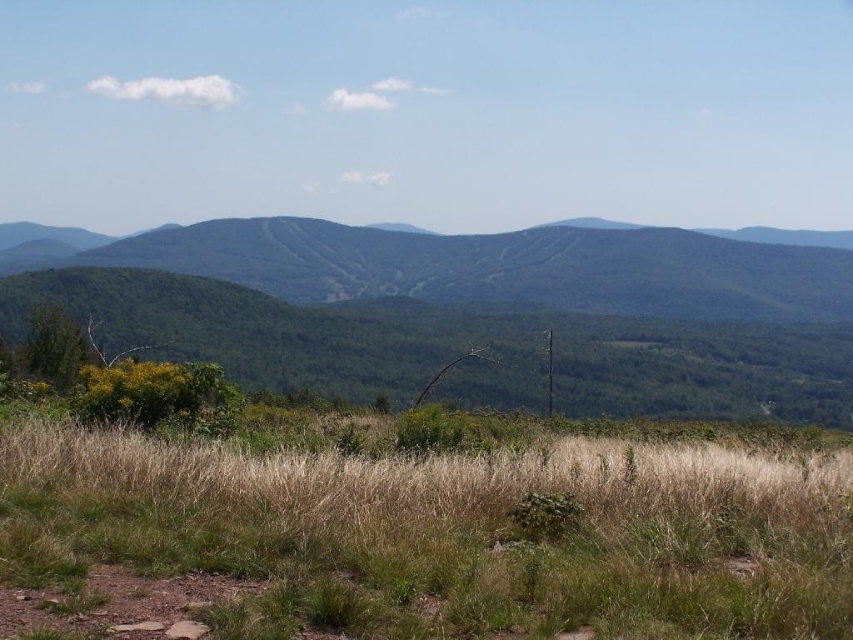
Between green grassy field at center and green forested mountain at center, which one is positioned lower?

green grassy field at center is below.

In the scene shown: Can you confirm if green grassy field at center is positioned below green forested mountain at center?

Indeed, green grassy field at center is positioned under green forested mountain at center.

Between point (688, 618) and point (270, 268), which one is positioned behind?

Positioned behind is point (270, 268).

Locate an element on the screen. The width and height of the screenshot is (853, 640). green grassy field at center is located at coordinates (445, 534).